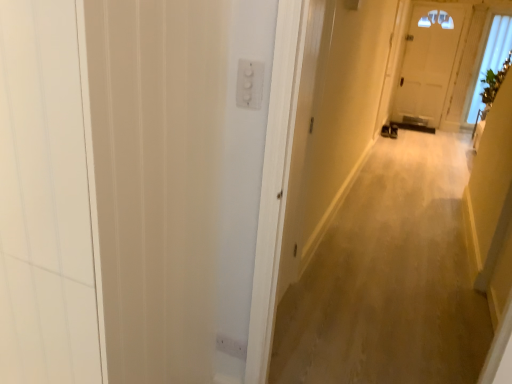
Question: Does white plastic switch at upper center have a greater width compared to beige carpet at center?

Choices:
 (A) yes
 (B) no

Answer: (B)

Question: Can you confirm if white plastic switch at upper center is smaller than beige carpet at center?

Choices:
 (A) yes
 (B) no

Answer: (A)

Question: Considering the relative positions of white plastic switch at upper center and beige carpet at center in the image provided, is white plastic switch at upper center behind beige carpet at center?

Choices:
 (A) yes
 (B) no

Answer: (B)

Question: Is white plastic switch at upper center outside beige carpet at center?

Choices:
 (A) no
 (B) yes

Answer: (B)

Question: Considering the relative positions of white plastic switch at upper center and beige carpet at center in the image provided, is white plastic switch at upper center to the left of beige carpet at center from the viewer's perspective?

Choices:
 (A) no
 (B) yes

Answer: (B)

Question: From the image's perspective, does white plastic switch at upper center appear higher than beige carpet at center?

Choices:
 (A) no
 (B) yes

Answer: (B)

Question: Does white wood screen door at left have a smaller size compared to white plastic switch at upper center?

Choices:
 (A) no
 (B) yes

Answer: (A)

Question: Is white wood screen door at left not close to white plastic switch at upper center?

Choices:
 (A) no
 (B) yes

Answer: (A)

Question: Can you confirm if white wood screen door at left is bigger than white plastic switch at upper center?

Choices:
 (A) yes
 (B) no

Answer: (A)

Question: From a real-world perspective, does white wood screen door at left sit lower than white plastic switch at upper center?

Choices:
 (A) no
 (B) yes

Answer: (B)

Question: Is white wood screen door at left outside white plastic switch at upper center?

Choices:
 (A) no
 (B) yes

Answer: (B)

Question: Is white wood screen door at left at the left side of white plastic switch at upper center?

Choices:
 (A) no
 (B) yes

Answer: (B)

Question: Does white plastic switch at upper center have a greater width compared to transparent glass window at upper right?

Choices:
 (A) yes
 (B) no

Answer: (B)